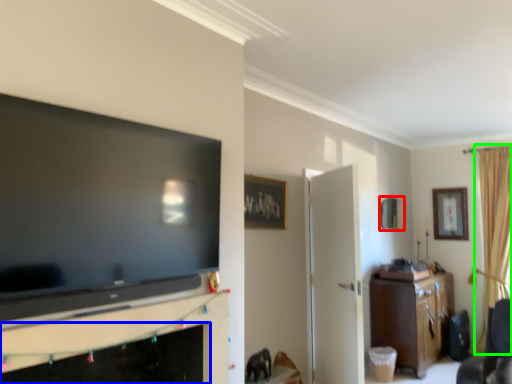
Question: Estimate the real-world distances between objects in this image. Which object is farther from picture frame (highlighted by a red box), fireplace (highlighted by a blue box) or curtain (highlighted by a green box)?

Choices:
 (A) fireplace
 (B) curtain

Answer: (A)